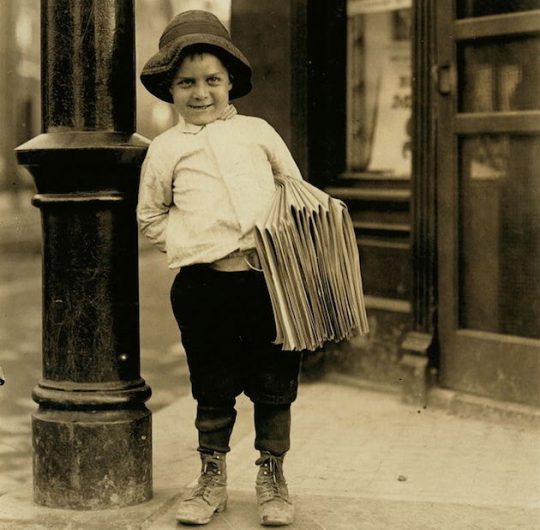
The height and width of the screenshot is (530, 540). I want to click on newspapers, so click(x=293, y=282).